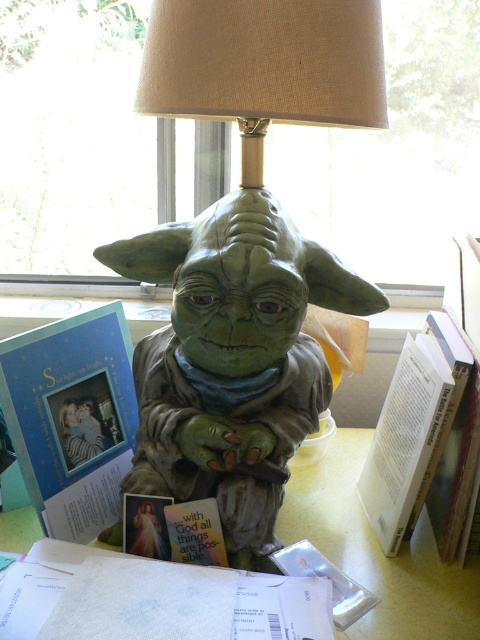
Question: Does beige fabric lampshade at upper center have a greater width compared to matte green statue at center?

Choices:
 (A) no
 (B) yes

Answer: (B)

Question: Does beige fabric lampshade at upper center have a lesser width compared to matte green statue at center?

Choices:
 (A) no
 (B) yes

Answer: (A)

Question: Which of these objects is positioned farthest from the green matte yoda statue at center?

Choices:
 (A) white textured paper at lower center
 (B) beige fabric lampshade at upper center
 (C) matte green statue at center
 (D) matte blue card at left

Answer: (C)

Question: Among these objects, which one is farthest from the camera?

Choices:
 (A) beige fabric lampshade at upper center
 (B) green matte yoda statue at center

Answer: (B)

Question: Can you confirm if matte blue card at left is bigger than matte green statue at center?

Choices:
 (A) yes
 (B) no

Answer: (B)

Question: Which of the following is the closest to the observer?

Choices:
 (A) (239, 227)
 (B) (59, 460)
 (C) (156, 636)

Answer: (C)